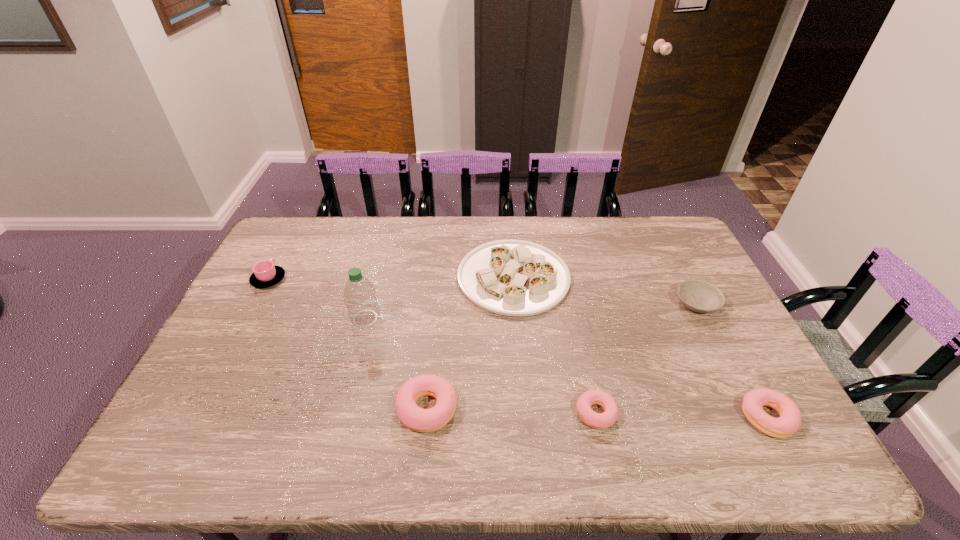
Identify the location of the tallest doughnut. This screenshot has height=540, width=960. (416, 418).

Locate an element on the screen. The width and height of the screenshot is (960, 540). the second doughnut from left to right is located at coordinates pyautogui.click(x=606, y=419).

Find the location of a particular element. The image size is (960, 540). the second tallest doughnut is located at coordinates (789, 422).

You are a GUI agent. You are given a task and a screenshot of the screen. Output one action in this format:
    pyautogui.click(x=<x>, y=<y>)
    Task: Click on the platter
    This screenshot has width=960, height=540.
    Given the screenshot: What is the action you would take?
    pyautogui.click(x=510, y=277)

Identify the location of bowl. (699, 296).

You are a GUI agent. You are given a task and a screenshot of the screen. Output one action in this format:
    pyautogui.click(x=<x>, y=<y>)
    Task: Click on the water bottle
    This screenshot has height=540, width=960.
    Given the screenshot: What is the action you would take?
    pyautogui.click(x=360, y=295)

The width and height of the screenshot is (960, 540). In order to click on the tallest object in this screenshot , I will do `click(360, 295)`.

Where is `cup`? cup is located at coordinates (265, 274).

This screenshot has width=960, height=540. I want to click on free space located 0.050m on the left of the tallest doughnut, so click(x=377, y=409).

Where is `vacant space positioned 0.370m on the right of the shortest doughnut`? The height and width of the screenshot is (540, 960). vacant space positioned 0.370m on the right of the shortest doughnut is located at coordinates (765, 413).